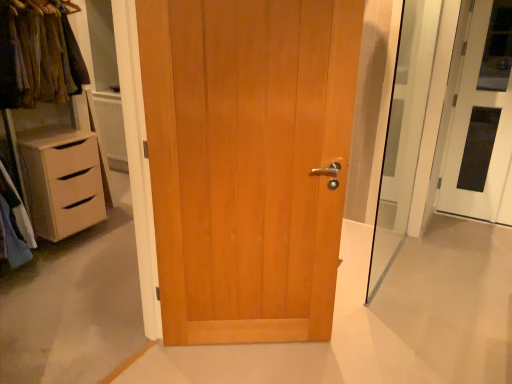
Question: Would you say white glossy door at right, which ranks as the 1th door in right-to-left order, is part of light brown wood door at center, the 1th door in the left-to-right sequence,'s contents?

Choices:
 (A) yes
 (B) no

Answer: (B)

Question: From a real-world perspective, is light brown wood door at center, the 2th door from the right, physically below white glossy door at right, the 2th door positioned from the left?

Choices:
 (A) yes
 (B) no

Answer: (A)

Question: Is light brown wood door at center, the first door when ordered from front to back, at the right side of white glossy door at right, which ranks as the 1th door in right-to-left order?

Choices:
 (A) yes
 (B) no

Answer: (B)

Question: Can you confirm if light brown wood door at center, the first door when ordered from front to back, is wider than white glossy door at right, the first door when ordered from back to front?

Choices:
 (A) no
 (B) yes

Answer: (B)

Question: From the image's perspective, would you say light brown wood door at center, the 2th door from the right, is positioned over white glossy door at right, the 2th door positioned from the left?

Choices:
 (A) no
 (B) yes

Answer: (A)

Question: Is transparent glass screen door at right spatially inside light brown wood door at center, the 1th door in the left-to-right sequence, or outside of it?

Choices:
 (A) inside
 (B) outside

Answer: (B)

Question: Considering the positions of transparent glass screen door at right and light brown wood door at center, the 2th door from the right, in the image, is transparent glass screen door at right bigger or smaller than light brown wood door at center, the 2th door from the right,?

Choices:
 (A) small
 (B) big

Answer: (A)

Question: Considering the relative positions of transparent glass screen door at right and light brown wood door at center, the 2th door from the back, in the image provided, is transparent glass screen door at right to the left or to the right of light brown wood door at center, the 2th door from the back,?

Choices:
 (A) right
 (B) left

Answer: (A)

Question: From the image's perspective, relative to light brown wood door at center, the 2th door from the back, is transparent glass screen door at right above or below?

Choices:
 (A) above
 (B) below

Answer: (A)

Question: Is point (425, 11) closer or farther from the camera than point (467, 215)?

Choices:
 (A) closer
 (B) farther

Answer: (A)

Question: Is transparent glass screen door at right situated inside white glossy door at right, the 2th door positioned from the left, or outside?

Choices:
 (A) inside
 (B) outside

Answer: (B)

Question: From a real-world perspective, is transparent glass screen door at right above or below white glossy door at right, which ranks as the 1th door in right-to-left order?

Choices:
 (A) below
 (B) above

Answer: (A)

Question: Is transparent glass screen door at right wider or thinner than white glossy door at right, which ranks as the 1th door in right-to-left order?

Choices:
 (A) wide
 (B) thin

Answer: (A)

Question: In terms of size, does light brown wood door at center, the 2th door from the back, appear bigger or smaller than transparent glass screen door at right?

Choices:
 (A) big
 (B) small

Answer: (A)

Question: From the image's perspective, is light brown wood door at center, the 1th door in the left-to-right sequence, positioned above or below transparent glass screen door at right?

Choices:
 (A) above
 (B) below

Answer: (B)